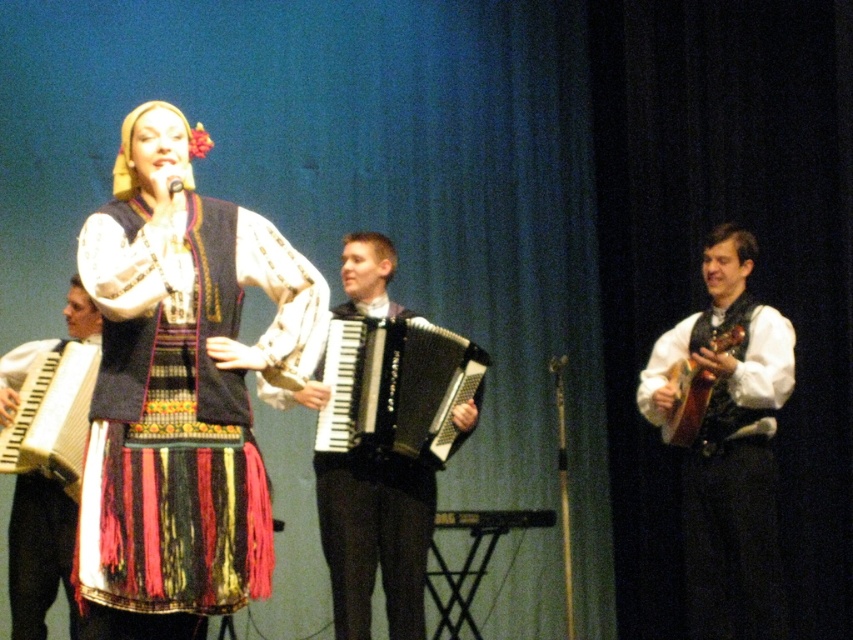
Is point (18, 476) positioned behind point (39, 417)?

Yes, it is behind point (39, 417).

Is wooden accordion at center shorter than wooden accordion at left?

Incorrect, wooden accordion at center's height does not fall short of wooden accordion at left's.

The width and height of the screenshot is (853, 640). What are the coordinates of `wooden accordion at center` in the screenshot? It's located at (39, 556).

Locate an element on the screen. This screenshot has height=640, width=853. wooden accordion at center is located at coordinates (39, 556).

Looking at this image, is black glossy accordion at center thinner than wooden accordion at left?

No, black glossy accordion at center is not thinner than wooden accordion at left.

At what (x,y) coordinates should I click in order to perform the action: click on black glossy accordion at center. Please return your answer as a coordinate pair (x, y). Looking at the image, I should click on (375, 538).

You are a GUI agent. You are given a task and a screenshot of the screen. Output one action in this format:
    pyautogui.click(x=<x>, y=<y>)
    Task: Click on the black glossy accordion at center
    The height and width of the screenshot is (640, 853).
    Given the screenshot: What is the action you would take?
    coord(375,538)

Can you confirm if black glossy accordion at center is positioned above wooden accordion at center?

Correct, black glossy accordion at center is located above wooden accordion at center.

Which is behind, point (465, 433) or point (53, 515)?

Positioned behind is point (465, 433).

The width and height of the screenshot is (853, 640). What do you see at coordinates (375, 538) in the screenshot?
I see `black glossy accordion at center` at bounding box center [375, 538].

Identify the location of black glossy accordion at center. (375, 538).